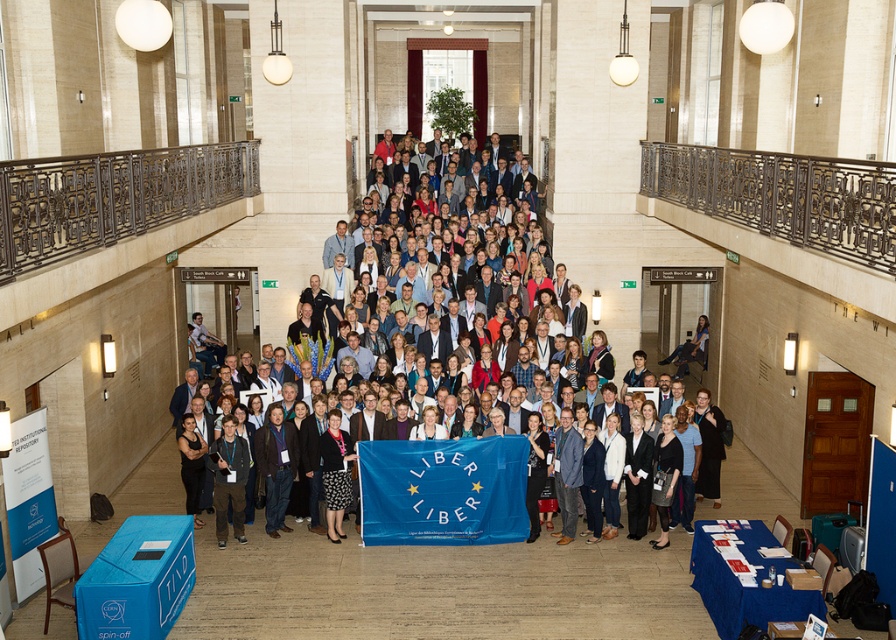
You are standing in the grand hall and need to move from the first point to the second point. Considering the layout of the hall, can you walk directly from point (x=231, y=228) to point (x=368, y=524) without any obstacles?

Point (x=231, y=228) is behind point (x=368, y=524), so you cannot walk directly between them without moving around the obstacle in front of point (x=368, y=524).

You are organizing a photo shoot in the grand hall described. You need to position a photographer to capture both the blue fabric banner at center and the blue fabric flag at center in the same frame. Where should the photographer stand relative to these objects to ensure both are visible?

The photographer should stand to the left of both the blue fabric banner at center and the blue fabric flag at center so that the blue fabric banner at center, which is to the right of the blue fabric flag at center, remains in frame.

You are an event planner trying to set up a photo shoot for the group. You need to know which blue fabric item is higher up in the scene. Which one is higher between the blue fabric banner at center and the blue fabric flag at center?

The blue fabric banner at center is positioned over the blue fabric flag at center, so the banner is higher up.